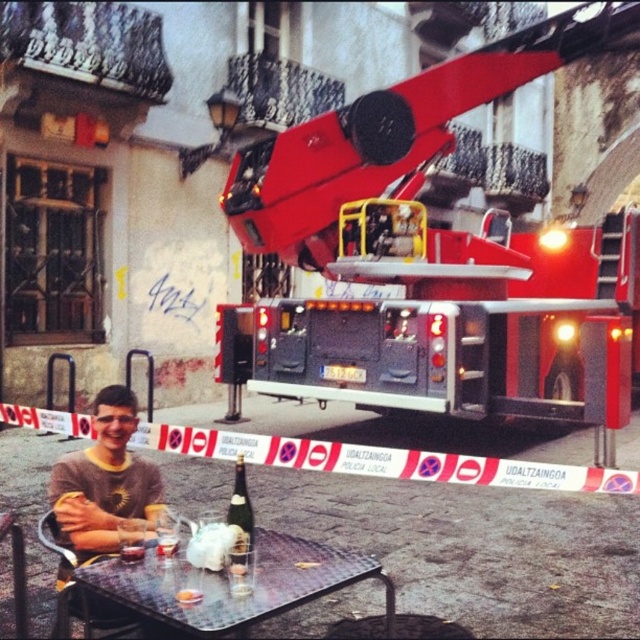
Question: Among these points, which one is nearest to the camera?

Choices:
 (A) (384, 113)
 (B) (240, 566)
 (C) (179, 589)

Answer: (C)

Question: Is shiny red fire truck at upper right above matte glass bottle at table center?

Choices:
 (A) no
 (B) yes

Answer: (B)

Question: Can you confirm if shiny red fire truck at upper right is bigger than matte glass bottle at table center?

Choices:
 (A) no
 (B) yes

Answer: (B)

Question: Can you confirm if shiny red fire truck at upper right is bigger than metallic silver table at center?

Choices:
 (A) yes
 (B) no

Answer: (B)

Question: Estimate the real-world distances between objects in this image. Which object is closer to the metallic silver table at center?

Choices:
 (A) matte glass bottle at table center
 (B) clear glass wine at table center

Answer: (A)

Question: Which of the following is the closest to the observer?

Choices:
 (A) pyautogui.click(x=232, y=490)
 (B) pyautogui.click(x=90, y=544)

Answer: (B)